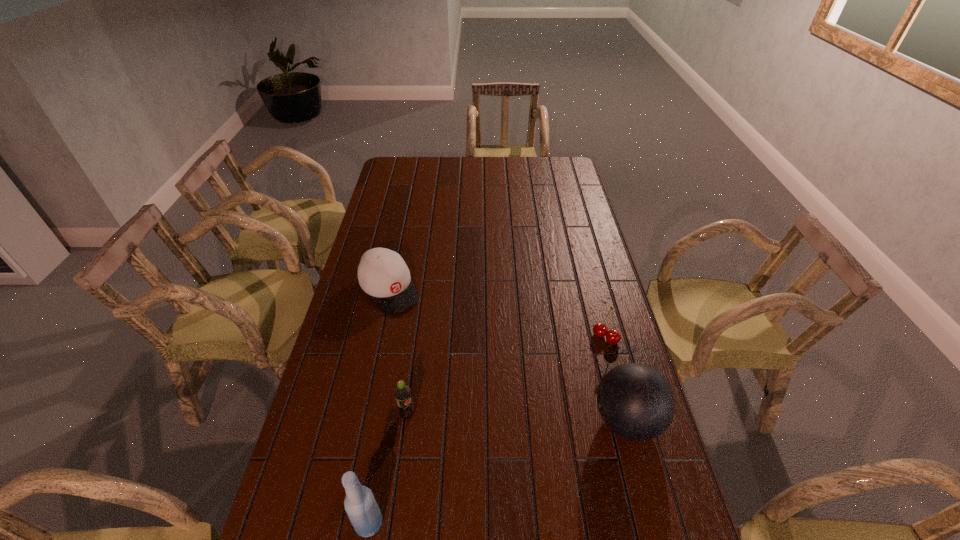
You are a GUI agent. You are given a task and a screenshot of the screen. Output one action in this format:
    pyautogui.click(x=<x>, y=<y>)
    Task: Click on the empty space between the second farthest object and the soda
    The image size is (960, 540).
    Given the screenshot: What is the action you would take?
    pyautogui.click(x=506, y=376)

Image resolution: width=960 pixels, height=540 pixels. In order to click on free space that is in between the soda and the farthest object in this screenshot , I will do `click(398, 353)`.

This screenshot has height=540, width=960. What are the coordinates of `vacant point located between the second tallest object and the baseball cap` in the screenshot? It's located at (508, 355).

The width and height of the screenshot is (960, 540). I want to click on free area in between the tallest object and the bowling ball, so click(498, 472).

Locate an element on the screen. The image size is (960, 540). vacant area that lies between the second tallest object and the farthest object is located at coordinates (508, 355).

What are the coordinates of `unoccupied area between the second farthest object and the baseball cap` in the screenshot? It's located at (497, 314).

Where is `object that is the second nearest to the bowling ball`? object that is the second nearest to the bowling ball is located at coordinates (402, 392).

Image resolution: width=960 pixels, height=540 pixels. I want to click on the closest object to the bowling ball, so click(600, 330).

Locate an element on the screen. This screenshot has height=540, width=960. free space that satisfies the following two spatial constraints: 1. on the front side of the farthest object; 2. on the grip area of the fourth shortest object is located at coordinates (x=362, y=421).

Locate an element on the screen. The width and height of the screenshot is (960, 540). free location that satisfies the following two spatial constraints: 1. on the front side of the fourth shortest object; 2. on the grip area of the soda is located at coordinates (407, 421).